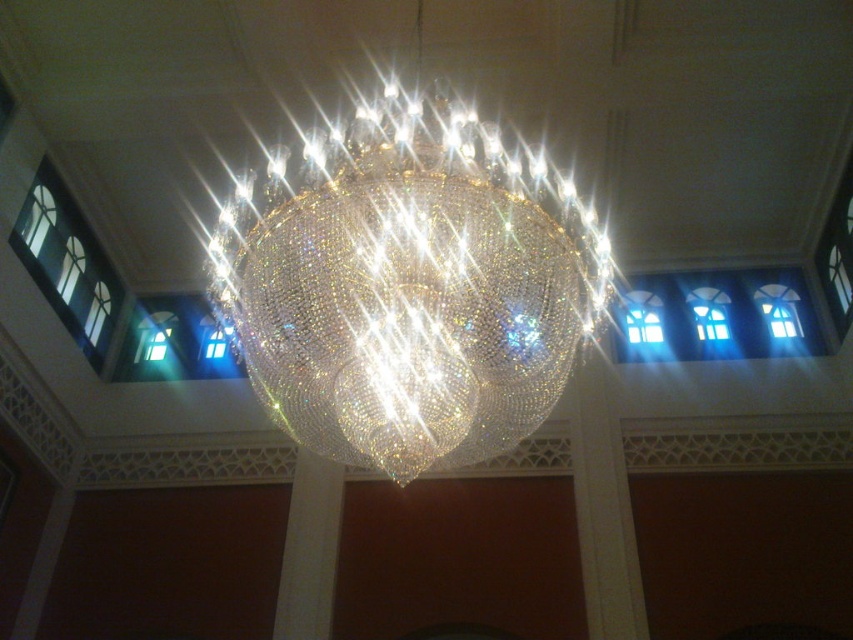
You are an interior designer planning to install a new lighting fixture that is 15 feet long. You need to ensure it fits between the crystal glass chandelier at center and the clear glass window at left. Based on the scene, can you confirm if there is enough space for the new fixture?

The distance between the crystal glass chandelier at center and the clear glass window at left is 16.01 feet, which is slightly more than the 15 feet length of the new fixture. Therefore, there is enough space for the new lighting fixture.

You are an interior designer planning to install a new lighting fixture. You have the crystal glass chandelier at center and the clear glass window at left in view. Which object would you need to consider for space requirements due to its size?

The crystal glass chandelier at center is bigger than the clear glass window at left, so you would need to consider the crystal glass chandelier at center for space requirements due to its larger size.

In the scene shown: You are standing in the grand interior space and want to locate the exact point where the light is most intense. According to the image, which object contains the point at coordinate (412, 291)?

The point at coordinate (412, 291) is on the crystal glass chandelier at center, so the most intense light is likely emanating from that area.